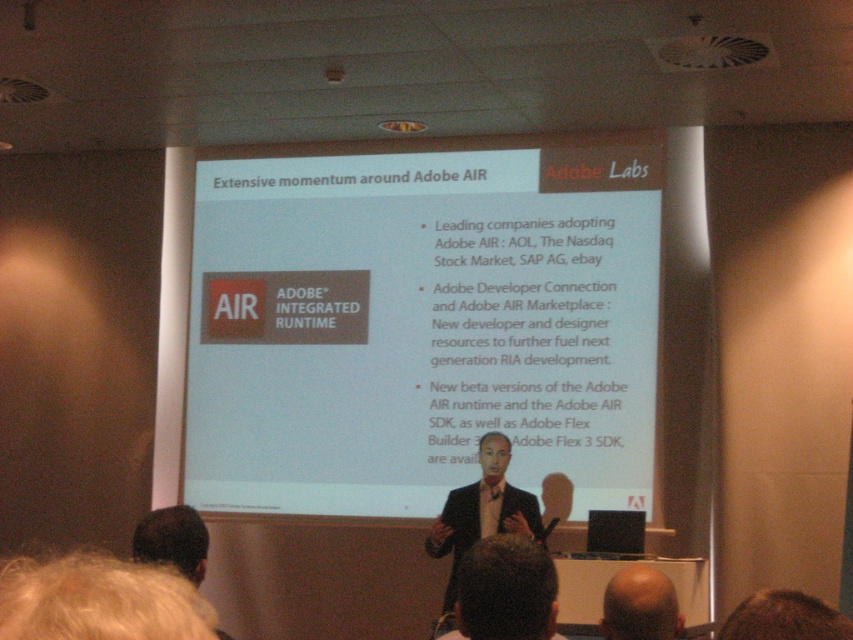
Between white paper at center and dark suit at center, which one has less height?

dark suit at center is shorter.

Is white paper at center positioned before dark suit at center?

No.

Measure the distance between point [389,314] and camera.

Point [389,314] and camera are 22.88 feet apart from each other.

This screenshot has width=853, height=640. Identify the location of white paper at center. (421, 324).

Between dark suit at center and bald head at center, which one appears on the left side from the viewer's perspective?

From the viewer's perspective, dark suit at center appears more on the left side.

This screenshot has height=640, width=853. Describe the element at coordinates (482, 509) in the screenshot. I see `dark suit at center` at that location.

Does point (438, 554) come behind point (663, 602)?

Yes, it is behind point (663, 602).

Locate an element on the screen. This screenshot has height=640, width=853. dark suit at center is located at coordinates (482, 509).

Does point (518, 547) come closer to viewer compared to point (492, 467)?

Yes, it is in front of point (492, 467).

Who is positioned more to the left, dark suit at lower center or dark suit at center?

From the viewer's perspective, dark suit at center appears more on the left side.

Does point (526, 548) lie in front of point (534, 538)?

Yes.

Identify the location of dark suit at lower center. This screenshot has height=640, width=853. (506, 589).